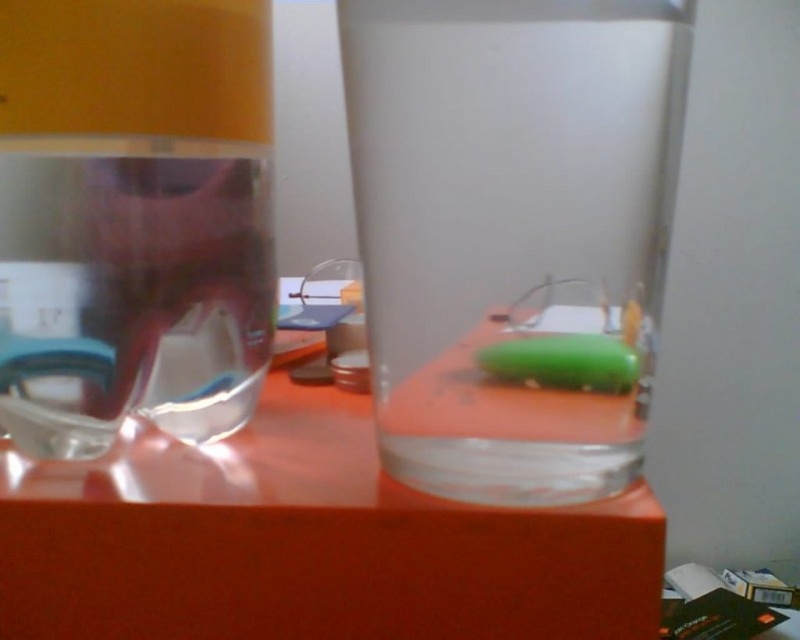
Is orange glossy table at center below transparent plastic bottle at left?

Indeed, orange glossy table at center is positioned under transparent plastic bottle at left.

Between point (264, 484) and point (8, 109), which one is positioned in front?

Point (8, 109) is more forward.

At what (x,y) coordinates should I click in order to perform the action: click on orange glossy table at center. Please return your answer as a coordinate pair (x, y). The image size is (800, 640). Looking at the image, I should click on (306, 541).